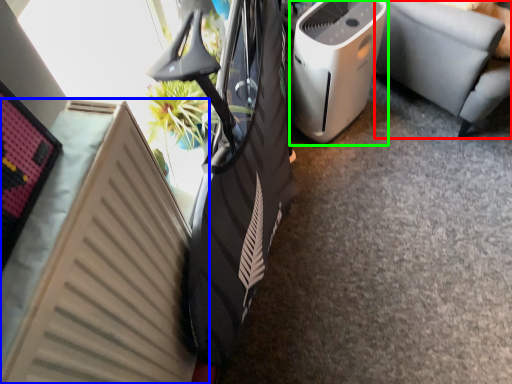
Question: Which object is positioned closest to furniture (highlighted by a red box)? Select from radiator (highlighted by a blue box) and home appliance (highlighted by a green box).

Choices:
 (A) radiator
 (B) home appliance

Answer: (B)